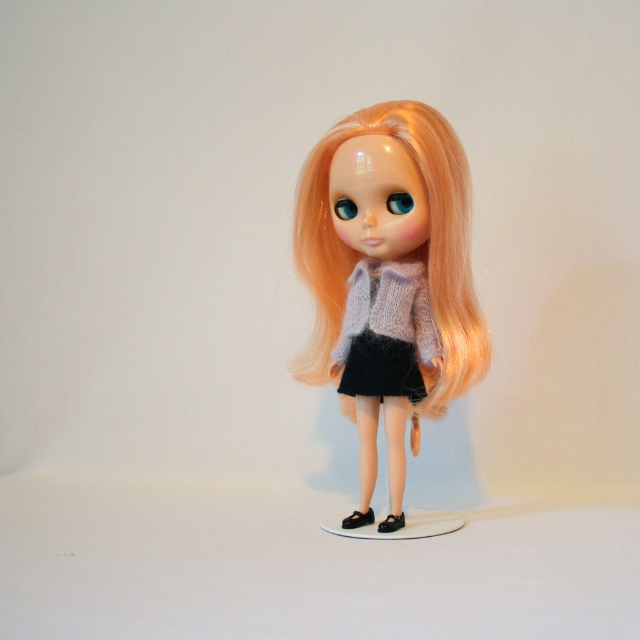
Question: Which point is closer to the camera?

Choices:
 (A) (376, 356)
 (B) (356, 333)

Answer: (A)

Question: In this image, where is matte purple sweater at center located relative to black knitted dress at center?

Choices:
 (A) left
 (B) right

Answer: (A)

Question: Among these objects, which one is farthest from the camera?

Choices:
 (A) matte purple sweater at center
 (B) black knitted dress at center

Answer: (B)

Question: Is matte purple sweater at center closer to camera compared to black knitted dress at center?

Choices:
 (A) no
 (B) yes

Answer: (B)

Question: Among these objects, which one is nearest to the camera?

Choices:
 (A) matte purple sweater at center
 (B) black knitted dress at center

Answer: (A)

Question: Can you confirm if matte purple sweater at center is positioned above black knitted dress at center?

Choices:
 (A) yes
 (B) no

Answer: (A)